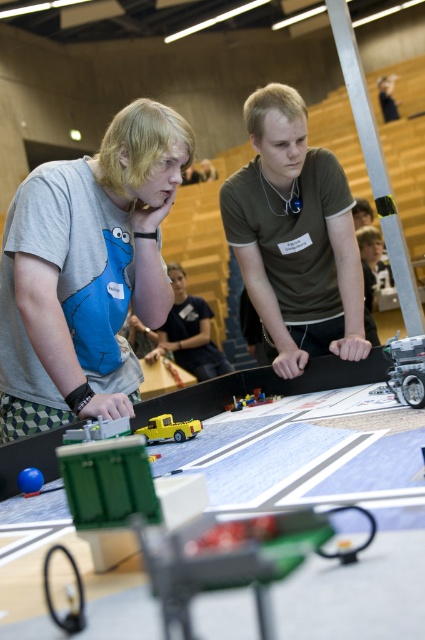
Question: Which object is farther from the camera taking this photo?

Choices:
 (A) blue rubber ball at lower left
 (B) metallic silver truck at lower right
 (C) matte gray shirt at center

Answer: (C)

Question: Does matte black shirt at center have a smaller size compared to blue rubber ball at lower left?

Choices:
 (A) no
 (B) yes

Answer: (A)

Question: Which object is closer to the camera taking this photo?

Choices:
 (A) brown matte shirt at center
 (B) brick-like plastic toy at center
 (C) matte gray shirt at center
 (D) matte black shirt at center

Answer: (C)

Question: Where is matte gray shirt at center located in relation to brick-like plastic toy at center in the image?

Choices:
 (A) above
 (B) below

Answer: (A)

Question: Can you confirm if brown matte shirt at center is bigger than metallic silver truck at lower right?

Choices:
 (A) no
 (B) yes

Answer: (B)

Question: Which of these objects is positioned closest to the matte black shirt at center?

Choices:
 (A) brown matte shirt at center
 (B) blue rubber ball at lower left
 (C) matte gray shirt at center
 (D) brick-like plastic toy at center

Answer: (A)